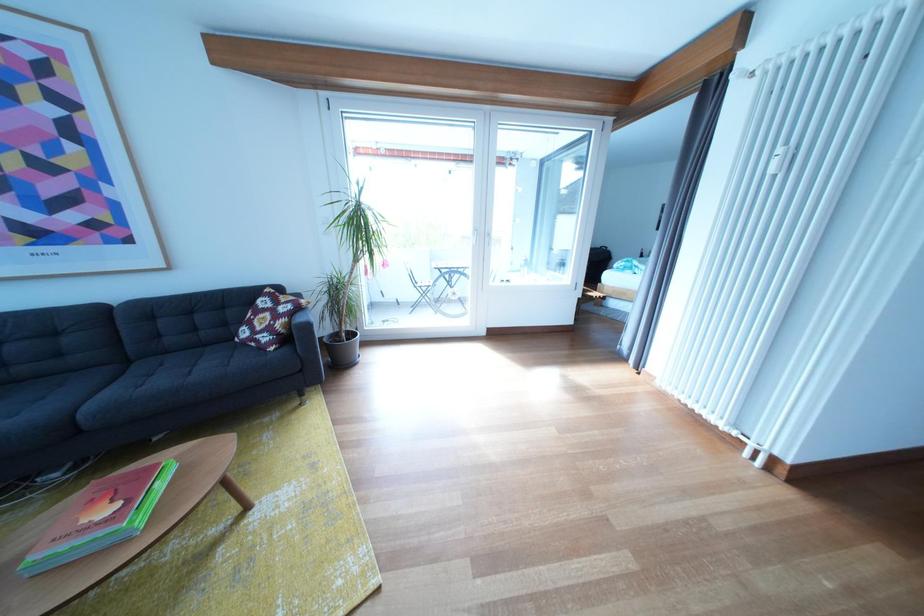
Where is `dark grey sofa surface`? This screenshot has width=924, height=616. dark grey sofa surface is located at coordinates (166, 379).